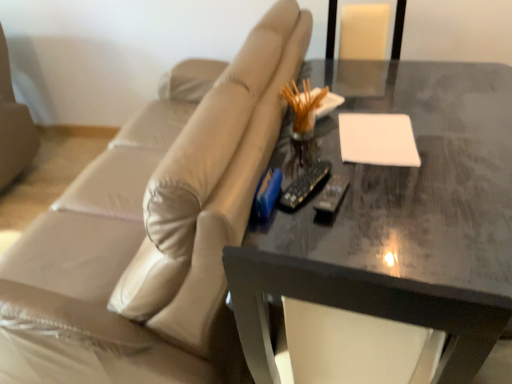
Locate an element on the screen. free point above white matte notepad at upper right (from a real-world perspective) is located at coordinates (375, 136).